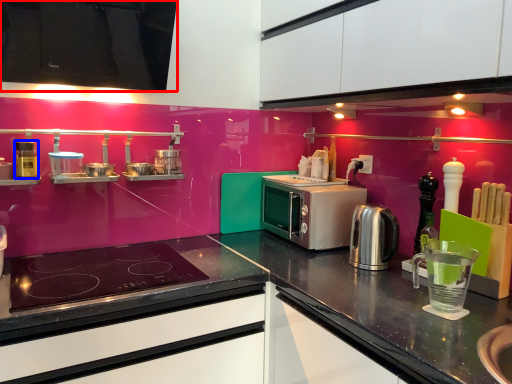
Question: Among these objects, which one is nearest to the camera, cabinetry (highlighted by a red box) or appliance (highlighted by a blue box)?

Choices:
 (A) cabinetry
 (B) appliance

Answer: (A)